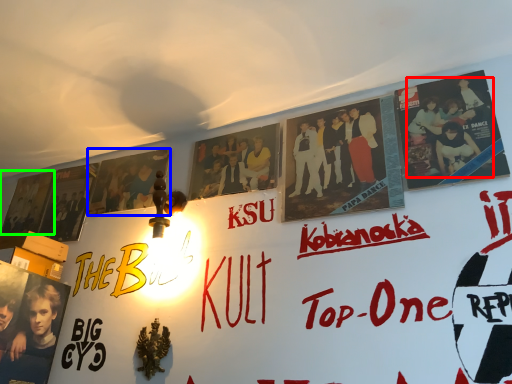
Question: Which object is the closest to the person (highlighted by a red box)? Choose among these: poster (highlighted by a blue box) or movie poster (highlighted by a green box).

Choices:
 (A) poster
 (B) movie poster

Answer: (A)